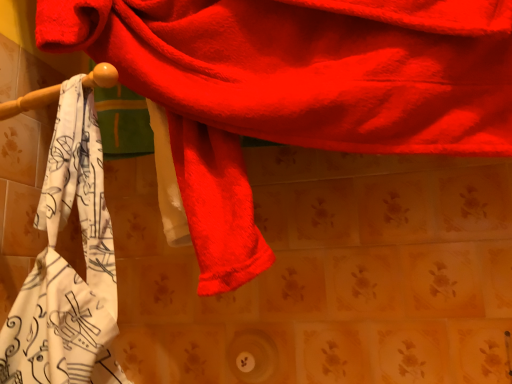
Question: Is fluffy red towel at upper center, which ranks as the 1th towel in right-to-left order, in front of or behind white printed towel at left, positioned as the second towel in right-to-left order, in the image?

Choices:
 (A) behind
 (B) front

Answer: (B)

Question: Is point (292, 19) positioned closer to the camera than point (58, 173)?

Choices:
 (A) farther
 (B) closer

Answer: (A)

Question: Considering the positions of fluffy red towel at upper center, which is the 2th towel from left to right, and white printed towel at left, positioned as the second towel in right-to-left order, in the image, is fluffy red towel at upper center, which is the 2th towel from left to right, wider or thinner than white printed towel at left, positioned as the second towel in right-to-left order,?

Choices:
 (A) thin
 (B) wide

Answer: (A)

Question: From the image's perspective, is white printed towel at left, positioned as the second towel in right-to-left order, above or below fluffy red towel at upper center, which is the 2th towel from left to right?

Choices:
 (A) above
 (B) below

Answer: (B)

Question: Does point (95, 327) appear closer or farther from the camera than point (253, 225)?

Choices:
 (A) farther
 (B) closer

Answer: (B)

Question: Visually, is white printed towel at left, which appears as the 1th towel when viewed from the left, positioned to the left or to the right of fluffy red towel at upper center, which is the 2th towel from left to right?

Choices:
 (A) left
 (B) right

Answer: (A)

Question: Considering the positions of white printed towel at left, positioned as the second towel in right-to-left order, and fluffy red towel at upper center, which ranks as the 1th towel in right-to-left order, in the image, is white printed towel at left, positioned as the second towel in right-to-left order, taller or shorter than fluffy red towel at upper center, which ranks as the 1th towel in right-to-left order,?

Choices:
 (A) tall
 (B) short

Answer: (B)